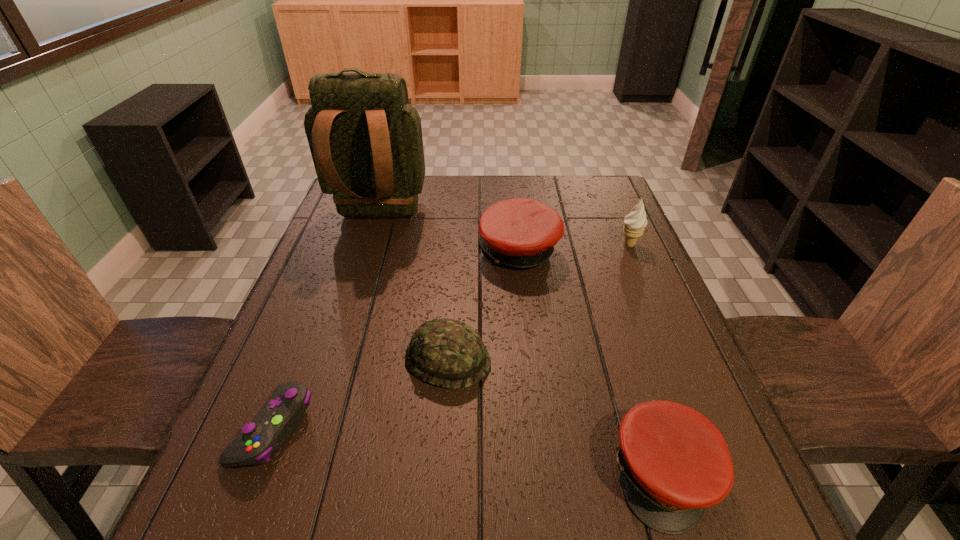
The height and width of the screenshot is (540, 960). I want to click on free space between the farthest cap and the control, so click(396, 339).

Where is `free point between the farthest cap and the second nearest cap`? free point between the farthest cap and the second nearest cap is located at coordinates (484, 305).

Locate an element on the screen. This screenshot has width=960, height=540. free point between the tallest object and the shortest object is located at coordinates (326, 322).

Identify the location of vacant area that lies between the backpack and the shortest object. (326, 322).

This screenshot has width=960, height=540. I want to click on vacant area that lies between the nearest cap and the second nearest cap, so click(x=556, y=417).

You are a GUI agent. You are given a task and a screenshot of the screen. Output one action in this format:
    pyautogui.click(x=<x>, y=<y>)
    Task: Click on the vacant space that's between the shortest object and the farthest cap
    This screenshot has height=540, width=960.
    Given the screenshot: What is the action you would take?
    pyautogui.click(x=396, y=339)

This screenshot has height=540, width=960. I want to click on empty space between the farthest cap and the second nearest cap, so click(484, 305).

What are the coordinates of `empty space between the backpack and the second nearest cap` in the screenshot? It's located at (414, 288).

You are a GUI agent. You are given a task and a screenshot of the screen. Output one action in this format:
    pyautogui.click(x=<x>, y=<y>)
    Task: Click on the free point between the second tallest object and the second farthest cap
    
    Given the screenshot: What is the action you would take?
    pyautogui.click(x=539, y=302)

Where is `the fifth closest object to the second nearest cap`? This screenshot has height=540, width=960. the fifth closest object to the second nearest cap is located at coordinates (634, 224).